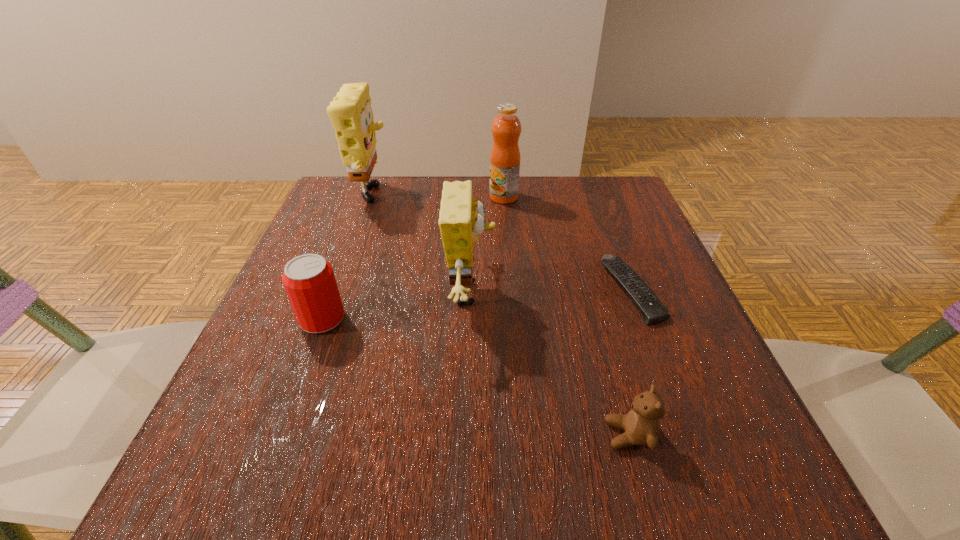
This screenshot has height=540, width=960. In order to click on free space located on the face of the left sponge in this screenshot , I will do `click(481, 199)`.

This screenshot has width=960, height=540. Identify the location of vacant region located on the right of the fruit juice. (636, 197).

At what (x,y) coordinates should I click in order to perform the action: click on vacant space located on the face of the right sponge. Please return your answer as a coordinate pair (x, y). This screenshot has width=960, height=540. Looking at the image, I should click on (552, 294).

Identify the location of vacant space positioned on the back of the third shortest object. (370, 192).

Image resolution: width=960 pixels, height=540 pixels. Find the location of `free space located on the front-facing side of the nearest object`. free space located on the front-facing side of the nearest object is located at coordinates (355, 434).

You are a GUI agent. You are given a task and a screenshot of the screen. Output one action in this format:
    pyautogui.click(x=<x>, y=<y>)
    Task: Click on the vacant space situated on the front-facing side of the nearest object
    Image resolution: width=960 pixels, height=540 pixels.
    Given the screenshot: What is the action you would take?
    pyautogui.click(x=434, y=434)

Identify the location of vacant space situated on the front-facing side of the nearest object. The height and width of the screenshot is (540, 960). coord(341,434).

This screenshot has height=540, width=960. I want to click on free region located on the left of the remote control, so click(x=402, y=290).

Locate an element on the screen. The width and height of the screenshot is (960, 540). sponge situated at the far edge is located at coordinates (351, 115).

Identify the location of fruit juice that is at the far edge. This screenshot has width=960, height=540. (506, 128).